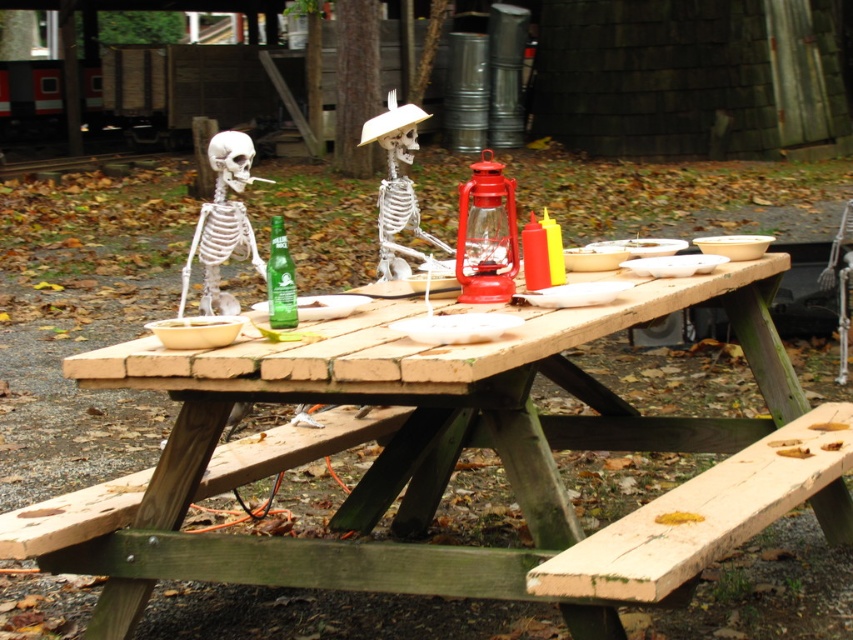
You are standing at the picnic table and see the white bone skeleton at left. Where is the white bone skeleton at left located relative to the point at coordinates [223,224]?

The white bone skeleton at left is located exactly at the point at coordinates [223,224].

You are standing at the origin point of the coordinate system. You need to place a new bench exactly 1 meter to the right of the wooden picnic table at center. Where should you place the bench?

The wooden picnic table at center is located at point (x=427, y=458). To place the bench 1 meter to the right, you would move along the x axis. The new coordinates would be 0.717 plus 1 meter, so the bench should be placed at point (x=427, y=458) plus 1 meter in the x direction. However, since the coordinate system might be normalized, you need to confirm the scale. Assuming the coordinates are in meters, the bench would be at (x=427, y=639).

You are standing at the edge of the picnic area and want to place a new bench to the left of the wooden picnic table at center. According to the scene, where should the bench be placed relative to the white matte skeleton at center?

The wooden picnic table at center is positioned on the right side of the white matte skeleton at center, so placing the bench to the left of the wooden picnic table at center would place it to the left of the white matte skeleton at center as well.